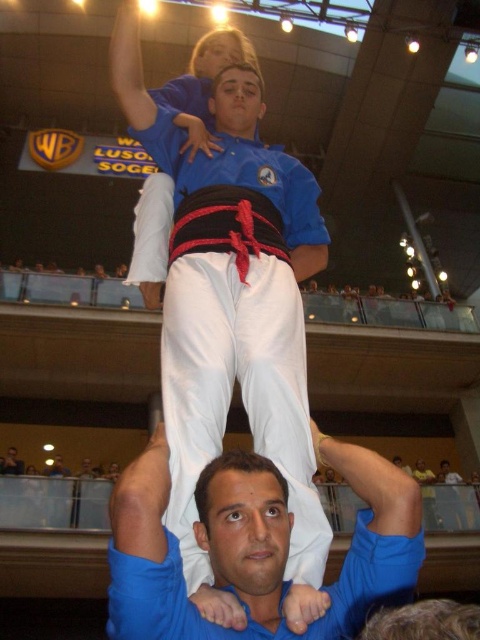
Question: Does white cotton pants at lower center appear on the left side of white cotton pants at center?

Choices:
 (A) yes
 (B) no

Answer: (B)

Question: Where is white cotton pants at lower center located in relation to white cotton pants at center in the image?

Choices:
 (A) above
 (B) below

Answer: (B)

Question: Which point is closer to the camera?

Choices:
 (A) (372, 518)
 (B) (218, 609)

Answer: (B)

Question: Among these objects, which one is nearest to the camera?

Choices:
 (A) white cotton pants at center
 (B) white cotton pants at lower center

Answer: (B)

Question: Does white cotton pants at lower center appear over white cotton pants at center?

Choices:
 (A) no
 (B) yes

Answer: (A)